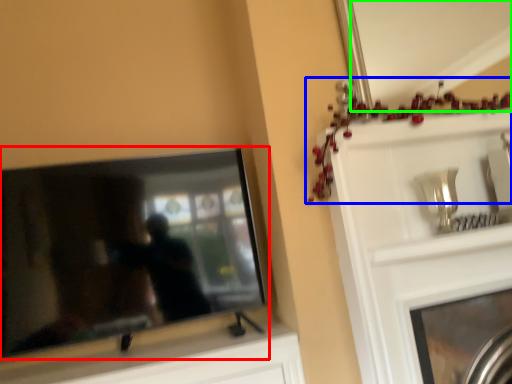
Question: Which object is positioned closest to television (highlighted by a red box)? Select from christmas decoration (highlighted by a blue box) and mirror (highlighted by a green box).

Choices:
 (A) christmas decoration
 (B) mirror

Answer: (A)